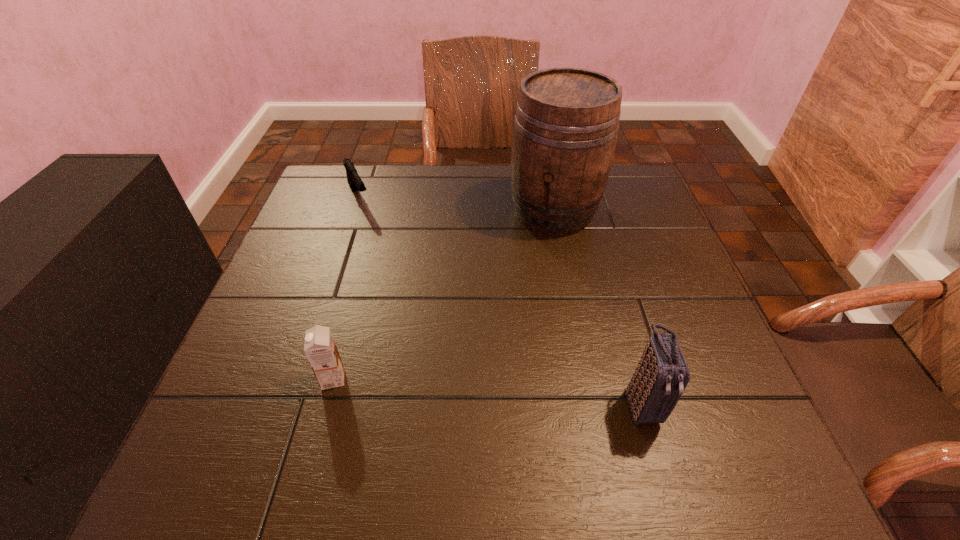
At what (x,y) coordinates should I click in order to perform the action: click on chocolate milk. Please return your answer as a coordinate pair (x, y). The image size is (960, 540). Looking at the image, I should click on (320, 348).

In order to click on clutch bag in this screenshot , I will do `click(662, 374)`.

Locate an element on the screen. the tallest object is located at coordinates (565, 130).

At what (x,y) coordinates should I click in order to perform the action: click on pistol. Please return your answer as a coordinate pair (x, y). The height and width of the screenshot is (540, 960). Looking at the image, I should click on (354, 180).

Where is `vacant space located on the right of the chocolate milk`? vacant space located on the right of the chocolate milk is located at coordinates (517, 379).

The image size is (960, 540). Identify the location of free location located on the side of the cider near the bung hole. (516, 291).

You are a GUI agent. You are given a task and a screenshot of the screen. Output one action in this format:
    pyautogui.click(x=<x>, y=<y>)
    Task: Click on the vacant area situated on the side of the cider near the bung hole
    This screenshot has height=540, width=960.
    Given the screenshot: What is the action you would take?
    pyautogui.click(x=533, y=255)

At what (x,y) coordinates should I click in order to perform the action: click on vacant space located on the side of the cider near the bung hole. Please return your answer as a coordinate pair (x, y). Looking at the image, I should click on (510, 303).

Locate an element on the screen. The width and height of the screenshot is (960, 540). free space located 0.140m on the front-facing side of the pistol is located at coordinates (379, 241).

Locate an element on the screen. The image size is (960, 540). vacant space positioned on the front-facing side of the pistol is located at coordinates (415, 305).